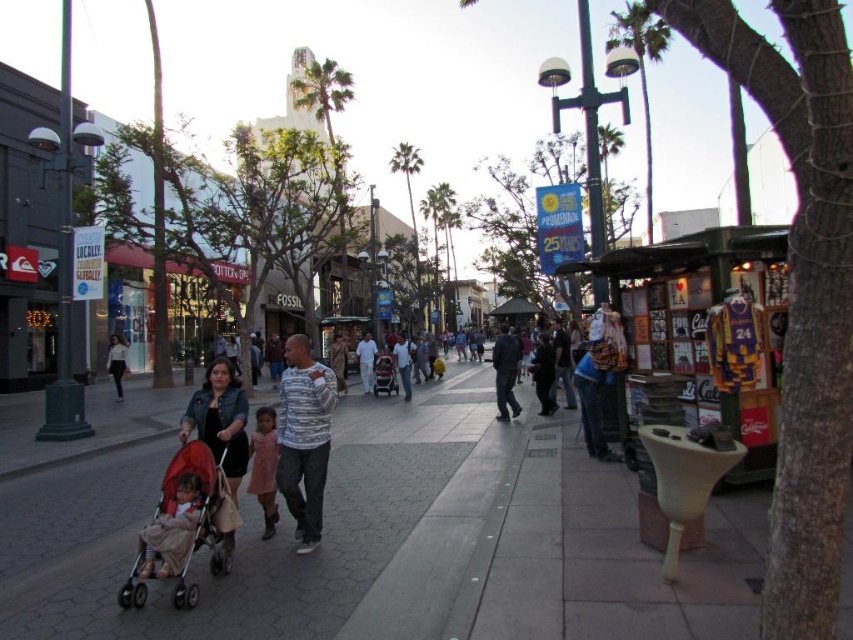
Question: Where is light brown fabric stroller at lower left located in relation to dark gray sweater at center in the image?

Choices:
 (A) left
 (B) right

Answer: (A)

Question: Does gray concrete sidewalk at center appear under matte pink stroller at center?

Choices:
 (A) yes
 (B) no

Answer: (A)

Question: Which object is positioned closest to the light blue jeans at center?

Choices:
 (A) metallic silver display stand at right
 (B) pink satin dress at center

Answer: (A)

Question: Based on their relative distances, which object is farther from the gray concrete sidewalk at center?

Choices:
 (A) red fabric stroller at lower left
 (B) matte glass storefront at center

Answer: (B)

Question: Among these points, which one is farthest from the camera?

Choices:
 (A) (392, 381)
 (B) (166, 540)
 (C) (15, 584)
 (D) (223, 472)

Answer: (A)

Question: Does metallic silver display stand at right have a larger size compared to white cotton shirt at center?

Choices:
 (A) no
 (B) yes

Answer: (B)